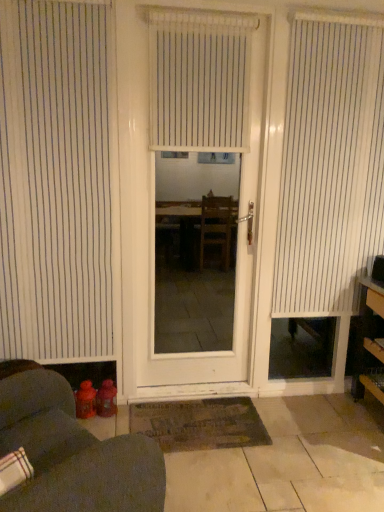
In order to click on free space that is in between wooden shelves at right and dark brown textured mat at center in this screenshot , I will do (x=311, y=429).